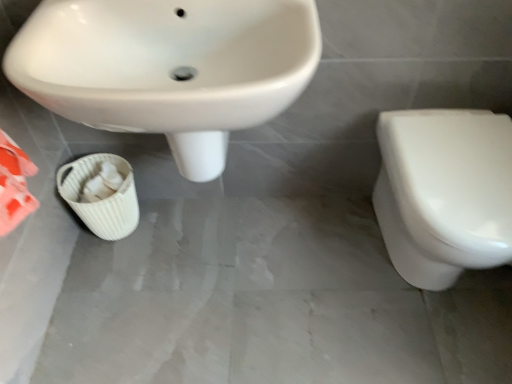
Question: Considering the relative positions of white glossy sink at upper left and white glossy toilet at right in the image provided, is white glossy sink at upper left to the right of white glossy toilet at right from the viewer's perspective?

Choices:
 (A) yes
 (B) no

Answer: (B)

Question: From a real-world perspective, is white glossy sink at upper left below white glossy toilet at right?

Choices:
 (A) no
 (B) yes

Answer: (A)

Question: Can you confirm if white glossy sink at upper left is bigger than white glossy toilet at right?

Choices:
 (A) no
 (B) yes

Answer: (B)

Question: Does white glossy sink at upper left have a greater height compared to white glossy toilet at right?

Choices:
 (A) no
 (B) yes

Answer: (B)

Question: Is white glossy sink at upper left oriented away from white glossy toilet at right?

Choices:
 (A) no
 (B) yes

Answer: (A)

Question: Is point (457, 243) positioned closer to the camera than point (227, 91)?

Choices:
 (A) closer
 (B) farther

Answer: (B)

Question: In terms of width, does white glossy toilet at right look wider or thinner when compared to white glossy sink at upper left?

Choices:
 (A) thin
 (B) wide

Answer: (B)

Question: Is white glossy toilet at right taller or shorter than white glossy sink at upper left?

Choices:
 (A) short
 (B) tall

Answer: (A)

Question: Is white glossy toilet at right in front of or behind white glossy sink at upper left in the image?

Choices:
 (A) behind
 (B) front

Answer: (A)

Question: Looking at their shapes, would you say white glossy sink at upper left is wider or thinner than white woven basket at lower left?

Choices:
 (A) wide
 (B) thin

Answer: (A)

Question: Is white glossy sink at upper left in front of or behind white woven basket at lower left in the image?

Choices:
 (A) behind
 (B) front

Answer: (B)

Question: From a real-world perspective, relative to white woven basket at lower left, is white glossy sink at upper left vertically above or below?

Choices:
 (A) above
 (B) below

Answer: (A)

Question: From their relative heights in the image, would you say white glossy sink at upper left is taller or shorter than white woven basket at lower left?

Choices:
 (A) short
 (B) tall

Answer: (B)

Question: Is white glossy sink at upper left spatially inside white glossy toilet at right, or outside of it?

Choices:
 (A) outside
 (B) inside

Answer: (A)

Question: From a real-world perspective, is white glossy sink at upper left above or below white glossy toilet at right?

Choices:
 (A) below
 (B) above

Answer: (B)